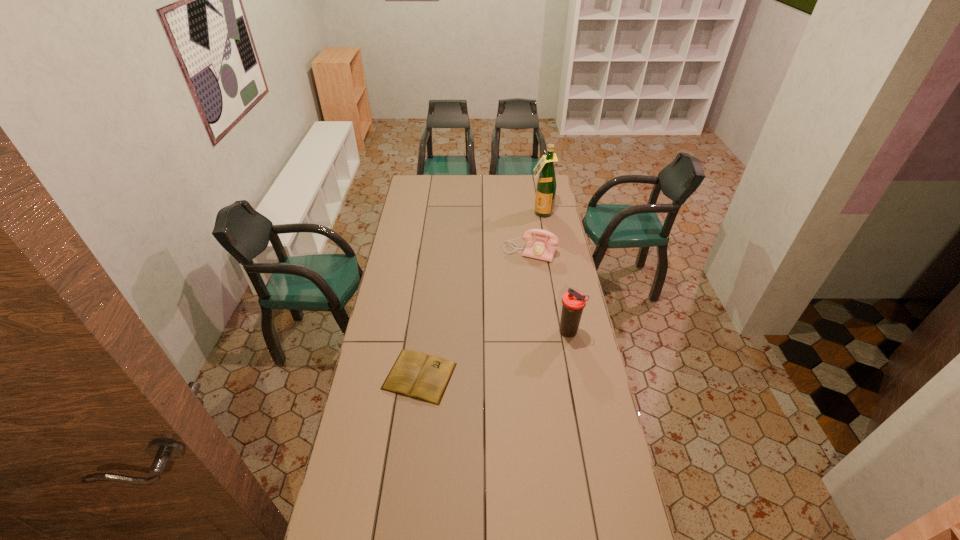
This screenshot has height=540, width=960. I want to click on the leftmost object, so click(x=414, y=374).

Locate an element on the screen. This screenshot has height=540, width=960. book is located at coordinates (414, 374).

Locate an element on the screen. The image size is (960, 540). the third shortest object is located at coordinates (573, 302).

Where is `thermos bottle`? thermos bottle is located at coordinates (573, 302).

Where is `the third nearest object`? The height and width of the screenshot is (540, 960). the third nearest object is located at coordinates (544, 247).

Locate an element on the screen. This screenshot has width=960, height=540. the third tallest object is located at coordinates (544, 247).

Locate an element on the screen. The image size is (960, 540). liquor is located at coordinates (546, 185).

Where is `the farthest object`? The width and height of the screenshot is (960, 540). the farthest object is located at coordinates (546, 185).

Find the location of a particular element. The height and width of the screenshot is (540, 960). free space located on the front of the leftmost object is located at coordinates (407, 476).

I want to click on vacant space located on the left of the second tallest object, so click(519, 333).